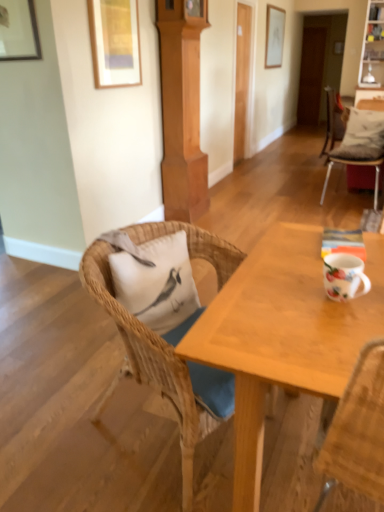
Identify the location of free space to the left of white cushioned chair at right, which is counted as the second chair, starting from the left. This screenshot has height=512, width=384. (307, 198).